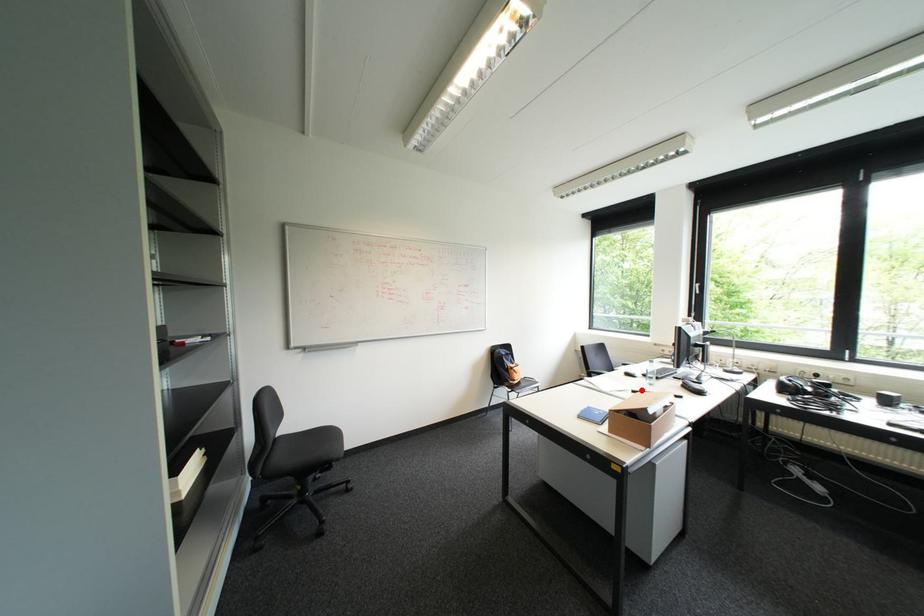
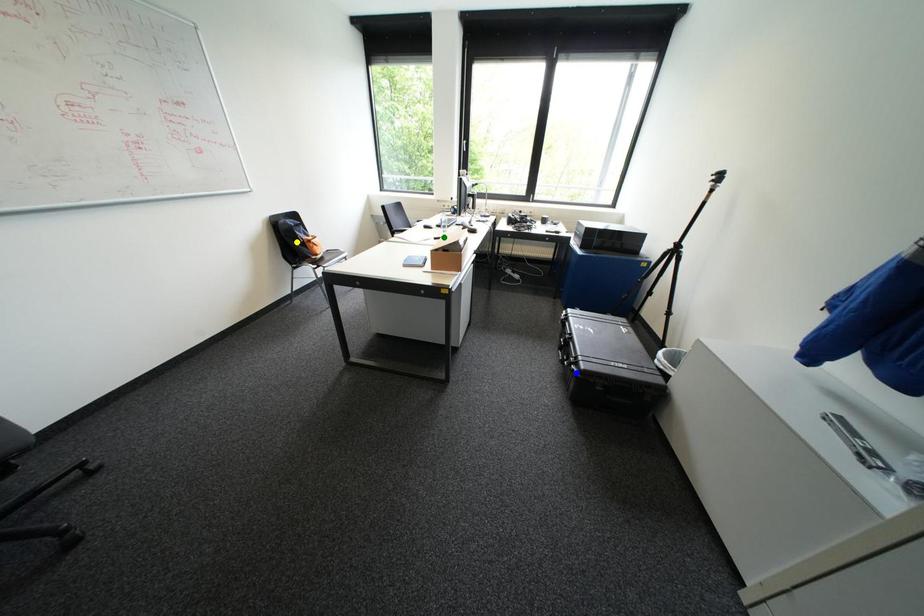
Question: I am providing you with two images of the same scene from different viewpoints. A red point is marked on the first image. You are given multiple points on the second image. Can you choose the point in image 2 that corresponds to the point in image 1?

Choices:
 (A) yellow point
 (B) blue point
 (C) green point

Answer: (C)